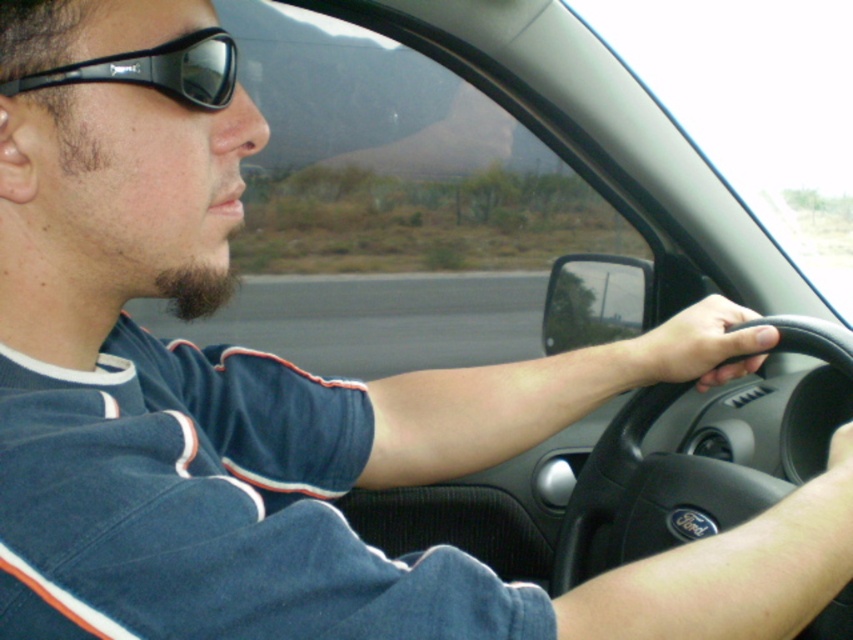
You are a photographer trying to capture a photo of the desert landscape through the car windshield. You notice two points marked in the scene. Which point is closer to the camera, point (833,611) or point (207,38)?

Point (207,38) is closer to the camera because the description states that point (833,611) is further away.

You are a car designer analyzing the interior of a vehicle. You notice the black rubber steering wheel at center and the black rubber sunglasses at upper left. Which object is wider?

The black rubber steering wheel at center might be wider than black rubber sunglasses at upper left.

You are a passenger in the car and want to hand the driver a map. The map is currently on the dashboard, which is located between the black rubber steering wheel at center and the black rubber sunglasses at upper left. Which object is closer to the map so you can reach it first?

The black rubber steering wheel at center is closer to the map because it is further to the viewer than the black rubber sunglasses at upper left, meaning the steering wheel is nearer to the dashboard where the map is placed.